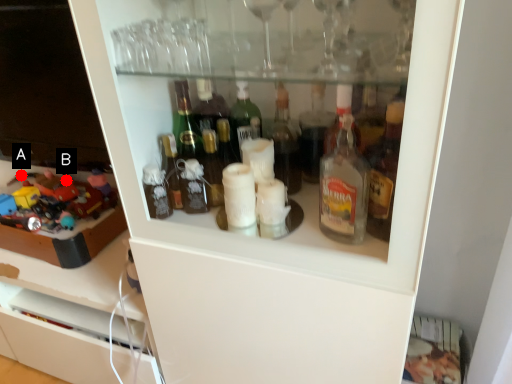
Question: Two points are circled on the image, labeled by A and B beside each circle. Which point is closer to the camera?

Choices:
 (A) A is closer
 (B) B is closer

Answer: (B)